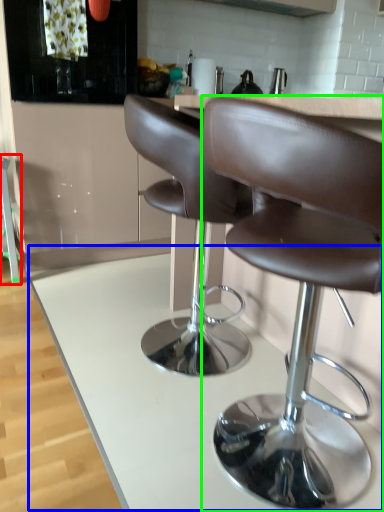
Question: Based on their relative distances, which object is farther from bar stool (highlighted by a red box)? Choose from counter (highlighted by a blue box) and chair (highlighted by a green box).

Choices:
 (A) counter
 (B) chair

Answer: (B)